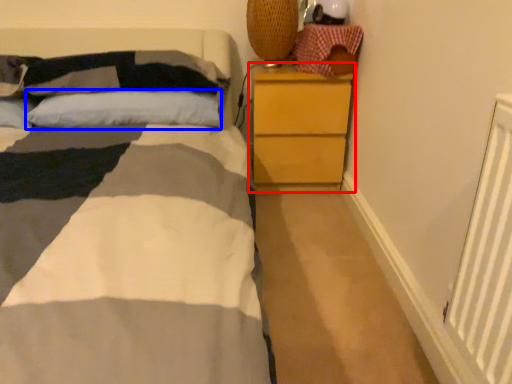
Question: Which point is closer to the camera, chest of drawers (highlighted by a red box) or pillow (highlighted by a blue box)?

Choices:
 (A) chest of drawers
 (B) pillow

Answer: (B)